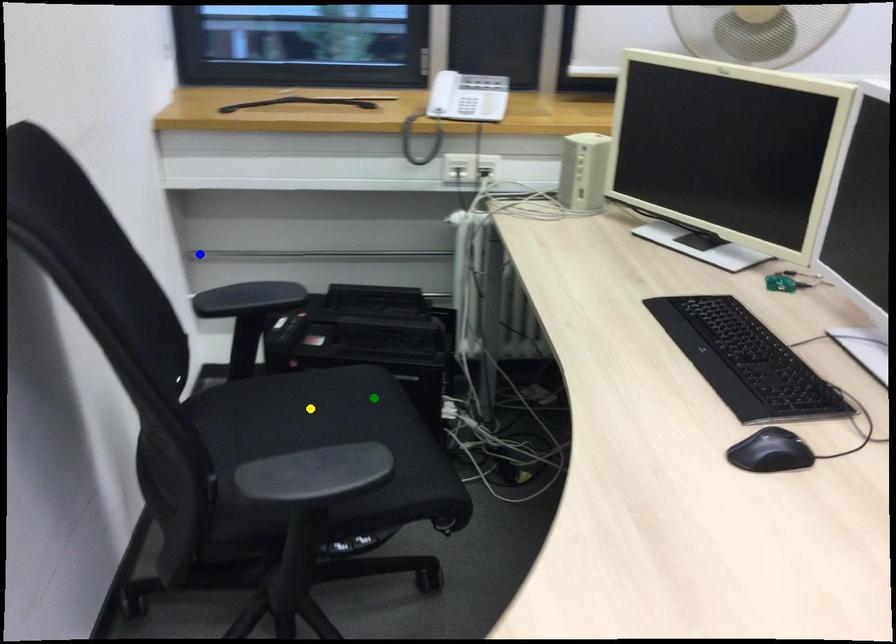
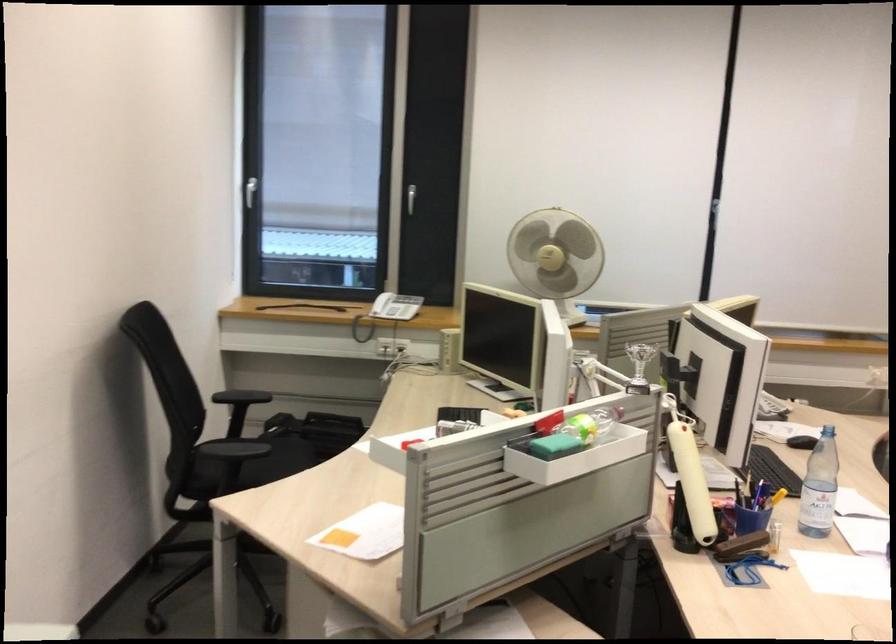
I am providing you with two images of the same scene from different viewpoints. Three points are marked in image1. Which point corresponds to a part or object that is occluded in image2?In image1, three points are marked. Which of them correspond to a part or object that is occluded in image2?Among the three points shown in image1, which one corresponds to a part or object that is no longer visible due to occlusion in image2?

Invisible in image2: yellow point.